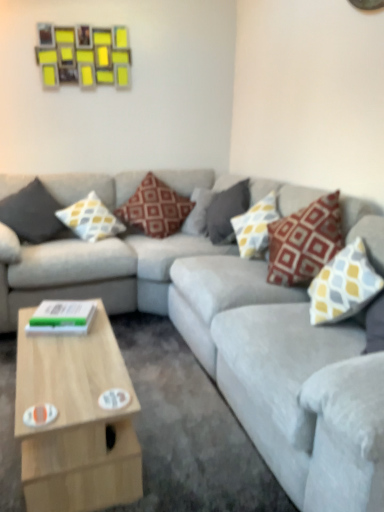
What do you see at coordinates (226, 211) in the screenshot?
I see `gray fabric pillow at center, the third pillow when ordered from right to left` at bounding box center [226, 211].

This screenshot has width=384, height=512. What do you see at coordinates (255, 227) in the screenshot? I see `yellow-gray patterned pillow at center, which ranks as the second pillow in right-to-left order` at bounding box center [255, 227].

Find the location of a particular element. light wood coffee table at lower left is located at coordinates (76, 420).

What is the approximate height of dark gray fabric pillow at left, the 1th pillow when ordered from left to right?

17.67 inches.

This screenshot has height=512, width=384. I want to click on gray fabric pillow at center, which is the fourth pillow from left to right, so click(226, 211).

Are light wood coffee table at lower left and gray fabric pillow at center, the third pillow when ordered from right to left, beside each other?

No, light wood coffee table at lower left is not in contact with gray fabric pillow at center, the third pillow when ordered from right to left.

Could you tell me if light wood coffee table at lower left is turned towards gray fabric pillow at center, which is the fourth pillow from left to right?

No, light wood coffee table at lower left is not facing towards gray fabric pillow at center, which is the fourth pillow from left to right.

Is light wood coffee table at lower left bigger or smaller than gray fabric pillow at center, which is the fourth pillow from left to right?

Clearly, light wood coffee table at lower left is larger in size than gray fabric pillow at center, which is the fourth pillow from left to right.

Which object is closer to the camera, light wood coffee table at lower left or gray fabric pillow at center, the third pillow when ordered from right to left?

light wood coffee table at lower left is closer to the camera.

How many degrees apart are the facing directions of yellow and gray patterned pillow at center, which is the 5th pillow in right-to-left order, and brown textured pillow at center, the 4th pillow positioned from the right?

The facing directions of yellow and gray patterned pillow at center, which is the 5th pillow in right-to-left order, and brown textured pillow at center, the 4th pillow positioned from the right, are 0.00025 degrees apart.

Considering the sizes of objects yellow and gray patterned pillow at center, which is the 5th pillow in right-to-left order, and brown textured pillow at center, which is the 3th pillow from left to right, in the image provided, who is wider, yellow and gray patterned pillow at center, which is the 5th pillow in right-to-left order, or brown textured pillow at center, which is the 3th pillow from left to right,?

With larger width is brown textured pillow at center, which is the 3th pillow from left to right.

Are yellow and gray patterned pillow at center, which is the 5th pillow in right-to-left order, and brown textured pillow at center, the 4th pillow positioned from the right, making contact?

No, yellow and gray patterned pillow at center, which is the 5th pillow in right-to-left order, is not with brown textured pillow at center, the 4th pillow positioned from the right.

From the picture: Considering the relative sizes of yellow and gray patterned pillow at center, which is the 5th pillow in right-to-left order, and brown textured pillow at center, the 4th pillow positioned from the right, in the image provided, is yellow and gray patterned pillow at center, which is the 5th pillow in right-to-left order, shorter than brown textured pillow at center, the 4th pillow positioned from the right,?

Yes.

Is brown textured pillow at center, which is the 3th pillow from left to right, far away from yellow-gray patterned pillow at center, arranged as the 5th pillow when viewed from the left?

brown textured pillow at center, which is the 3th pillow from left to right, is near yellow-gray patterned pillow at center, arranged as the 5th pillow when viewed from the left, not far away.

Which of these two, brown textured pillow at center, which is the 3th pillow from left to right, or yellow-gray patterned pillow at center, which ranks as the second pillow in right-to-left order, is thinner?

Thinner between the two is yellow-gray patterned pillow at center, which ranks as the second pillow in right-to-left order.

The height and width of the screenshot is (512, 384). I want to click on the 2nd pillow located beneath the yellow-gray patterned pillow at center, which ranks as the second pillow in right-to-left order (from a real-world perspective), so (155, 208).

Based on the photo, is the position of brown textured pillow at center, the 4th pillow positioned from the right, more distant than that of yellow-gray patterned pillow at center, arranged as the 5th pillow when viewed from the left?

Yes, brown textured pillow at center, the 4th pillow positioned from the right, is further from the camera.

From the image's perspective, which is above, yellow and gray patterned pillow at upper right, which is the first pillow in right-to-left order, or brown textured pillow at center, the 4th pillow positioned from the right?

brown textured pillow at center, the 4th pillow positioned from the right, from the image's perspective.

There is a brown textured pillow at center, which is the 3th pillow from left to right. Where is `the 3rd pillow below it (from a real-world perspective)`? the 3rd pillow below it (from a real-world perspective) is located at coordinates (343, 285).

Are yellow and gray patterned pillow at upper right, which is the 6th pillow from left to right, and brown textured pillow at center, the 4th pillow positioned from the right, making contact?

No, yellow and gray patterned pillow at upper right, which is the 6th pillow from left to right, is not next to brown textured pillow at center, the 4th pillow positioned from the right.

Is yellow and gray patterned pillow at upper right, which is the 6th pillow from left to right, placed right next to gray fabric pillow at center, the third pillow when ordered from right to left?

yellow and gray patterned pillow at upper right, which is the 6th pillow from left to right, and gray fabric pillow at center, the third pillow when ordered from right to left, are not in contact.

Can you confirm if yellow and gray patterned pillow at upper right, which is the 6th pillow from left to right, is positioned to the left of gray fabric pillow at center, the third pillow when ordered from right to left?

No, yellow and gray patterned pillow at upper right, which is the 6th pillow from left to right, is not to the left of gray fabric pillow at center, the third pillow when ordered from right to left.

Is yellow and gray patterned pillow at upper right, which is the 6th pillow from left to right, not within gray fabric pillow at center, which is the fourth pillow from left to right?

Yes, yellow and gray patterned pillow at upper right, which is the 6th pillow from left to right, is outside of gray fabric pillow at center, which is the fourth pillow from left to right.

Considering the sizes of objects yellow and gray patterned pillow at upper right, which is the 6th pillow from left to right, and gray fabric pillow at center, which is the fourth pillow from left to right, in the image provided, who is shorter, yellow and gray patterned pillow at upper right, which is the 6th pillow from left to right, or gray fabric pillow at center, which is the fourth pillow from left to right,?

yellow and gray patterned pillow at upper right, which is the 6th pillow from left to right.

From a real-world perspective, is brown textured pillow at center, the 4th pillow positioned from the right, beneath gray fabric pillow at center, the third pillow when ordered from right to left?

No.

Is brown textured pillow at center, the 4th pillow positioned from the right, turned away from gray fabric pillow at center, the third pillow when ordered from right to left?

brown textured pillow at center, the 4th pillow positioned from the right, is not turned away from gray fabric pillow at center, the third pillow when ordered from right to left.

Who is bigger, gray fabric pillow at center, which is the fourth pillow from left to right, or velvet gray couch at center?

velvet gray couch at center is bigger.

Is gray fabric pillow at center, which is the fourth pillow from left to right, aimed at velvet gray couch at center?

Yes, gray fabric pillow at center, which is the fourth pillow from left to right, is aimed at velvet gray couch at center.

From the image's perspective, is gray fabric pillow at center, the third pillow when ordered from right to left, located beneath velvet gray couch at center?

No, from the image's perspective, gray fabric pillow at center, the third pillow when ordered from right to left, is not beneath velvet gray couch at center.

Identify the location of the 3rd pillow located above the velvet gray couch at center (from a real-world perspective). Image resolution: width=384 pixels, height=512 pixels. click(226, 211).

Find the location of a particular element. The image size is (384, 512). coffee table below the gray fabric pillow at center, the third pillow when ordered from right to left (from the image's perspective) is located at coordinates (76, 420).

I want to click on pillow located above the yellow and gray patterned pillow at center, which is the 5th pillow in right-to-left order (from the image's perspective), so click(155, 208).

Estimate the real-world distances between objects in this image. Which object is closer to yellow and gray patterned pillow at center, which is the 5th pillow in right-to-left order, dark gray fabric pillow at left, which is the sixth pillow from right to left, or gray fabric pillow at center, the third pillow when ordered from right to left?

Among the two, dark gray fabric pillow at left, which is the sixth pillow from right to left, is located nearer to yellow and gray patterned pillow at center, which is the 5th pillow in right-to-left order.

Estimate the real-world distances between objects in this image. Which object is further from yellow-gray patterned pillow at center, arranged as the 5th pillow when viewed from the left, velvet gray couch at center or yellow and gray patterned pillow at center, the second pillow viewed from the left?

Among the two, yellow and gray patterned pillow at center, the second pillow viewed from the left, is located further to yellow-gray patterned pillow at center, arranged as the 5th pillow when viewed from the left.

Looking at the image, which one is located closer to yellow-gray patterned pillow at center, which ranks as the second pillow in right-to-left order, velvet gray couch at center or gray fabric pillow at center, which is the fourth pillow from left to right?

gray fabric pillow at center, which is the fourth pillow from left to right.

In the scene shown: Looking at the image, which one is located closer to yellow and gray patterned pillow at center, the second pillow viewed from the left, yellow and gray patterned pillow at upper right, which is the 6th pillow from left to right, or gray fabric pillow at center, which is the fourth pillow from left to right?

gray fabric pillow at center, which is the fourth pillow from left to right, is closer to yellow and gray patterned pillow at center, the second pillow viewed from the left.

Which object lies further to the anchor point velvet gray couch at center, dark gray fabric pillow at left, the 1th pillow when ordered from left to right, or brown textured pillow at center, the 4th pillow positioned from the right?

dark gray fabric pillow at left, the 1th pillow when ordered from left to right, is further to velvet gray couch at center.

Which object lies nearer to the anchor point brown textured pillow at center, the 4th pillow positioned from the right, velvet gray couch at center or yellow-gray patterned pillow at center, arranged as the 5th pillow when viewed from the left?

velvet gray couch at center is positioned closer to the anchor brown textured pillow at center, the 4th pillow positioned from the right.

Which object lies nearer to the anchor point dark gray fabric pillow at left, which is the sixth pillow from right to left, yellow-gray patterned pillow at center, which ranks as the second pillow in right-to-left order, or gray fabric pillow at center, which is the fourth pillow from left to right?

Based on the image, gray fabric pillow at center, which is the fourth pillow from left to right, appears to be nearer to dark gray fabric pillow at left, which is the sixth pillow from right to left.

Based on their spatial positions, is yellow and gray patterned pillow at upper right, which is the first pillow in right-to-left order, or gray fabric pillow at center, the third pillow when ordered from right to left, further from velvet gray couch at center?

gray fabric pillow at center, the third pillow when ordered from right to left, is positioned further to the anchor velvet gray couch at center.

This screenshot has height=512, width=384. Find the location of `coffee table located between dark gray fabric pillow at left, the 1th pillow when ordered from left to right, and yellow-gray patterned pillow at center, arranged as the 5th pillow when viewed from the left, in the left-right direction`. coffee table located between dark gray fabric pillow at left, the 1th pillow when ordered from left to right, and yellow-gray patterned pillow at center, arranged as the 5th pillow when viewed from the left, in the left-right direction is located at coordinates (76, 420).

Where is `coffee table positioned between velvet gray couch at center and yellow and gray patterned pillow at center, which is the 5th pillow in right-to-left order, from near to far`? The image size is (384, 512). coffee table positioned between velvet gray couch at center and yellow and gray patterned pillow at center, which is the 5th pillow in right-to-left order, from near to far is located at coordinates (76, 420).

Image resolution: width=384 pixels, height=512 pixels. I want to click on coffee table located between velvet gray couch at center and brown textured pillow at center, the 4th pillow positioned from the right, in the depth direction, so [x=76, y=420].

This screenshot has width=384, height=512. What are the coordinates of `pillow between yellow and gray patterned pillow at center, the second pillow viewed from the left, and gray fabric pillow at center, the third pillow when ordered from right to left, in the horizontal direction` in the screenshot? It's located at (155, 208).